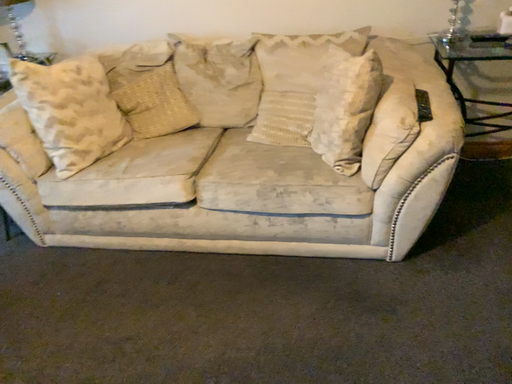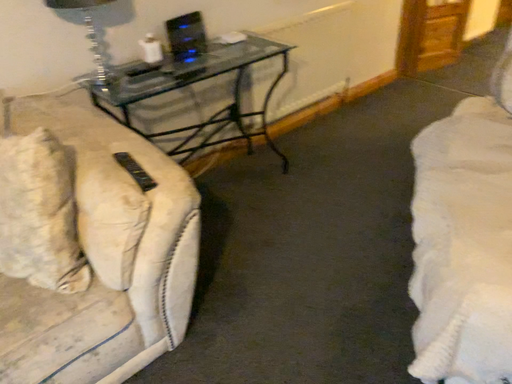
Question: How did the camera likely rotate when shooting the video?

Choices:
 (A) rotated downward
 (B) rotated upward

Answer: (B)